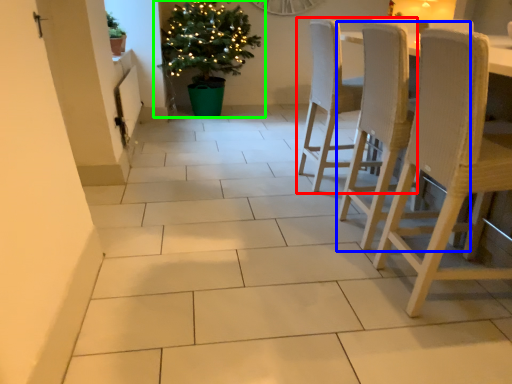
Question: Which object is the closest to the chair (highlighted by a red box)? Choose among these: chair (highlighted by a blue box) or houseplant (highlighted by a green box).

Choices:
 (A) chair
 (B) houseplant

Answer: (A)